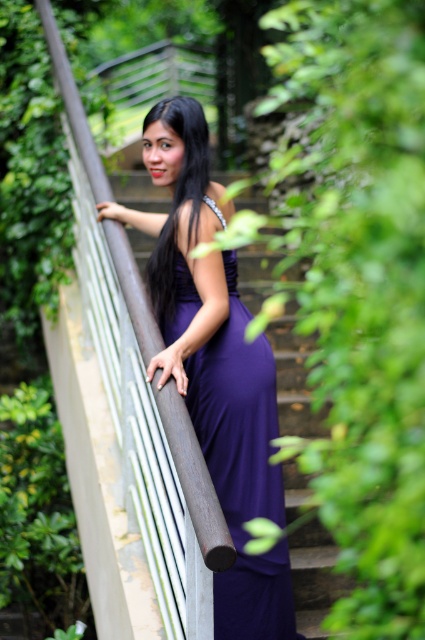
You are a fashion designer observing the woman in the image. You need to determine which object takes up more space in the scene between the purple satin dress at center and the black silky hair at upper center. Which one is it?

The purple satin dress at center is larger in size than the black silky hair at upper center, so the purple satin dress at center takes up more space in the scene.

You are a photographer trying to capture the purple satin dress at center in the image. The camera is positioned at point 0,0. Which direction should you move the camera to focus on the dress?

The purple satin dress at center is located at point (215, 365), so you should move the camera slightly to the right and upwards to focus on the dress.

You are taking a photo of the woman on the staircase. The camera is positioned to focus on the point at coordinates point (189, 291). If you want to include the point at coordinates point (187, 132) in the same frame, will you need to adjust the camera angle upwards or downwards?

Since point (189, 291) is closer to the camera than point (187, 132), you will need to adjust the camera angle upwards to include the point at coordinates point (187, 132) in the same frame.